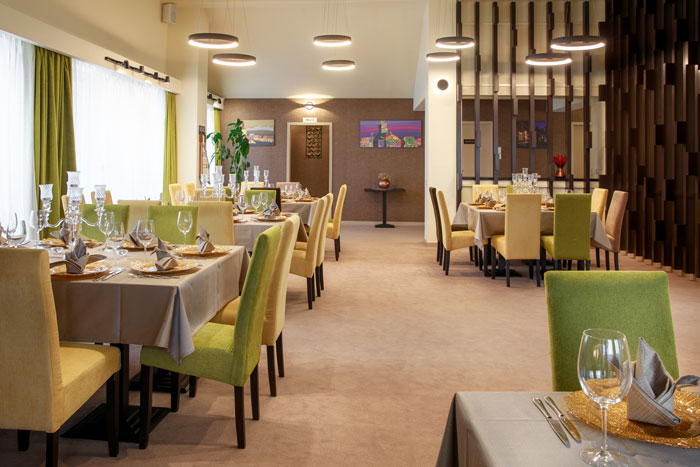
Locate an element on the screen. This screenshot has height=467, width=700. tables is located at coordinates (514, 431), (157, 314), (239, 230), (299, 204), (489, 226).